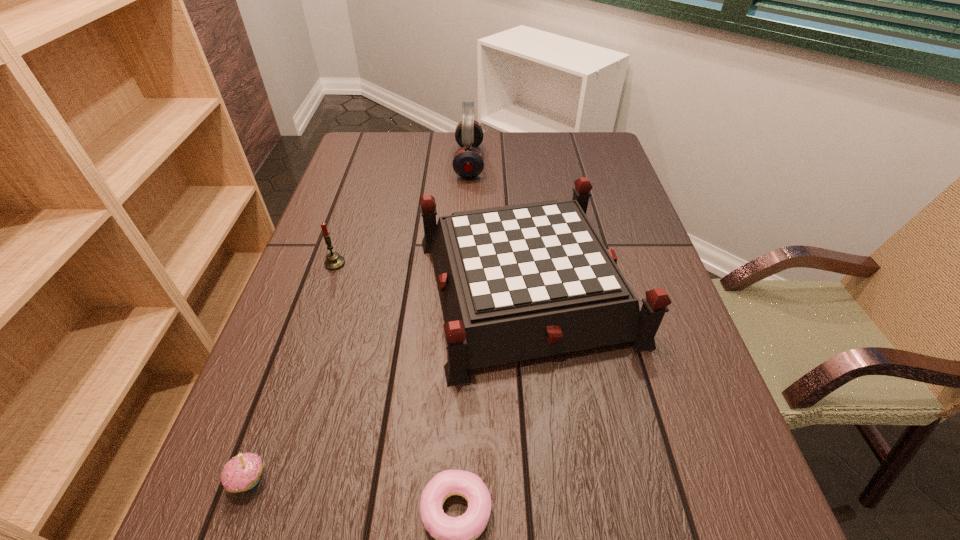
You are a GUI agent. You are given a task and a screenshot of the screen. Output one action in this format:
    pyautogui.click(x=<x>, y=<y>)
    Task: Click on the earphone
    
    Given the screenshot: What is the action you would take?
    pyautogui.click(x=468, y=162)

Identify the location of the farthest object. Image resolution: width=960 pixels, height=540 pixels. (468, 162).

At what (x,y) coordinates should I click in order to perform the action: click on the fourth shortest object. Please return your answer as a coordinate pair (x, y). Looking at the image, I should click on (517, 282).

Find the location of `candle`. candle is located at coordinates (334, 261).

Image resolution: width=960 pixels, height=540 pixels. Find the location of `the fourth tallest object`. the fourth tallest object is located at coordinates pos(241,473).

I want to click on vacant space located 0.120m on the ear cups of the tallest object, so click(522, 162).

This screenshot has width=960, height=540. Identify the location of vacant space located on the left of the second tallest object. (374, 289).

I want to click on free spot located on the front of the candle, so click(310, 336).

Locate an element on the screen. vacant space situated on the back of the second shortest object is located at coordinates (271, 421).

This screenshot has width=960, height=540. I want to click on object that is at the far edge, so click(468, 162).